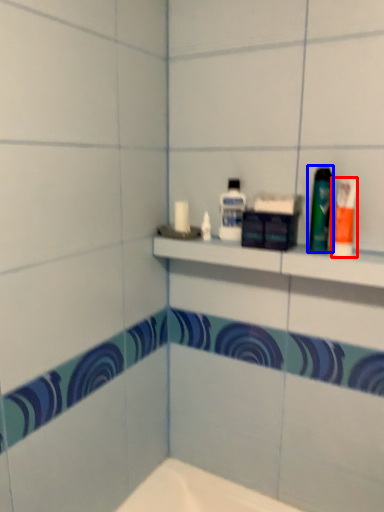
Question: Which object is closer to the camera taking this photo, toiletry (highlighted by a red box) or mouthwash (highlighted by a blue box)?

Choices:
 (A) toiletry
 (B) mouthwash

Answer: (A)